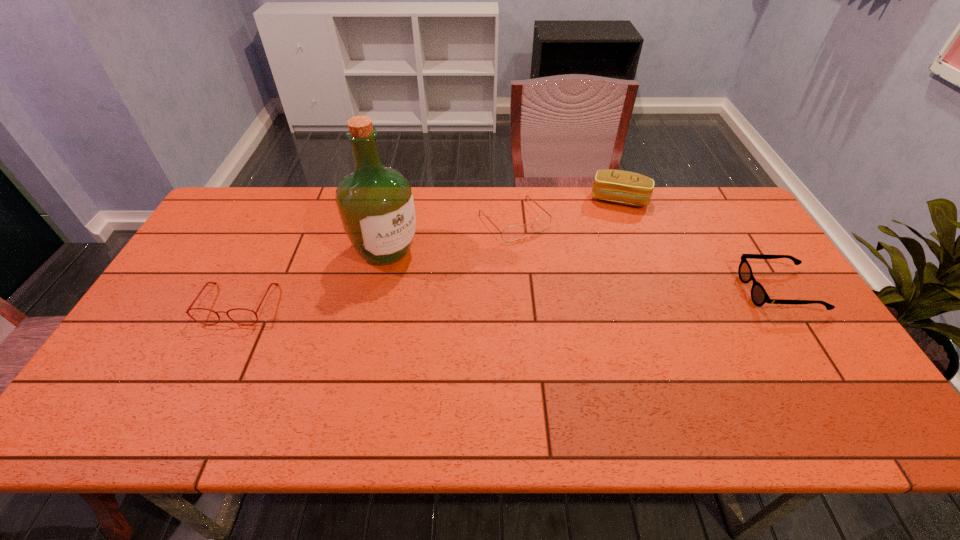
You are a GUI agent. You are given a task and a screenshot of the screen. Output one action in this format:
    pyautogui.click(x=<x>, y=<y>)
    Task: Click on the object that stands as the closest to the rightmost object
    
    Given the screenshot: What is the action you would take?
    pyautogui.click(x=618, y=186)

Find the location of a particular element. Image resolution: width=960 pixels, height=540 pixels. spectacles that stands as the second closest to the leftmost object is located at coordinates (759, 296).

This screenshot has height=540, width=960. I want to click on spectacles object that ranks as the second closest to the rightmost object, so click(x=207, y=283).